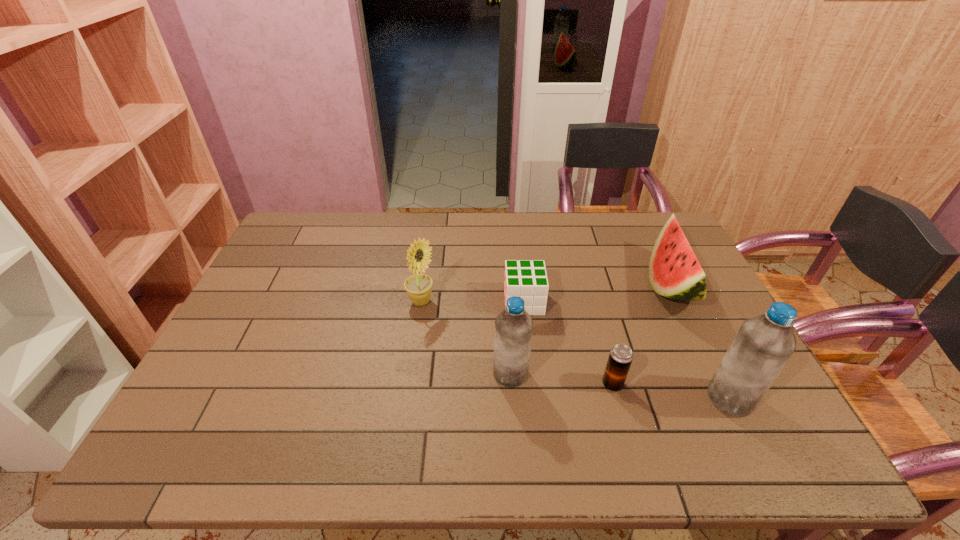
Identify the location of unoccupied position between the fourth tallest object and the tallest object. (700, 342).

The height and width of the screenshot is (540, 960). What are the coordinates of `free space between the cube and the fourth tallest object` in the screenshot? It's located at (596, 294).

You are a GUI agent. You are given a task and a screenshot of the screen. Output one action in this format:
    pyautogui.click(x=<x>, y=<y>)
    Task: Click on the vacant area between the cube and the fourth tallest object
    This screenshot has height=540, width=960.
    Given the screenshot: What is the action you would take?
    pyautogui.click(x=596, y=294)

At what (x,y) coordinates should I click in order to perform the action: click on free space between the watermelon and the left water bottle. Please return your answer as a coordinate pair (x, y). This screenshot has width=960, height=540. Looking at the image, I should click on (590, 330).

Identify which object is the third nearest to the sunflower. Please provide its 2D coordinates. Your answer should be formatted as a tuple, i.e. [(x, y)], where the tuple contains the x and y coordinates of a point satisfying the conditions above.

[(620, 358)]

I want to click on the closest object relative to the shorter water bottle, so click(527, 279).

Where is `vacant space that satisfies the following two spatial constraints: 1. on the red face of the cube; 2. on the left side of the third object from right to left`? The height and width of the screenshot is (540, 960). vacant space that satisfies the following two spatial constraints: 1. on the red face of the cube; 2. on the left side of the third object from right to left is located at coordinates (533, 384).

Image resolution: width=960 pixels, height=540 pixels. I want to click on blank space that satisfies the following two spatial constraints: 1. on the red face of the tallest object; 2. on the right side of the cube, so point(534,399).

What are the coordinates of `vacant region that satisfies the following two spatial constraints: 1. on the front side of the tallest object; 2. on the left side of the shorter water bottle` in the screenshot? It's located at click(x=512, y=399).

Locate an element on the screen. Image resolution: width=960 pixels, height=540 pixels. free location that satisfies the following two spatial constraints: 1. on the outer rind of the third shortest object; 2. on the front side of the shorter water bottle is located at coordinates (712, 374).